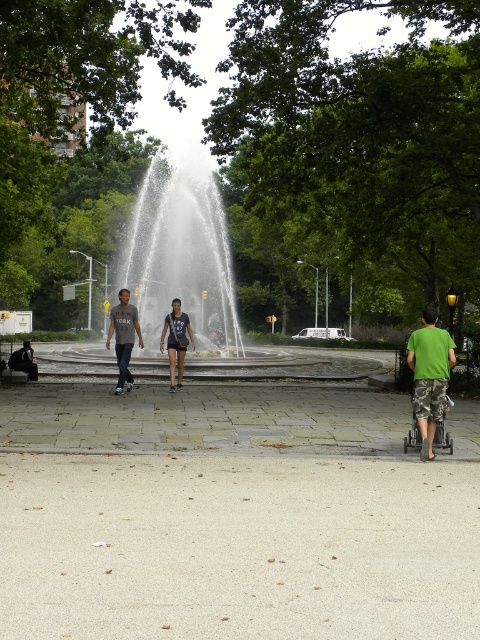
Can you confirm if matte gray t-shirt at center is smaller than matte black shorts at center?

Actually, matte gray t-shirt at center might be larger than matte black shorts at center.

Can you confirm if matte gray t-shirt at center is positioned to the right of matte black shorts at center?

In fact, matte gray t-shirt at center is to the left of matte black shorts at center.

Does point (129, 292) lie in front of point (175, 305)?

That is True.

The width and height of the screenshot is (480, 640). What are the coordinates of `matte gray t-shirt at center` in the screenshot? It's located at (123, 337).

Is the position of matte gray t-shirt at center more distant than that of gray cotton t-shirt at left?

No, it is not.

Is matte gray t-shirt at center to the right of gray cotton t-shirt at left from the viewer's perspective?

Correct, you'll find matte gray t-shirt at center to the right of gray cotton t-shirt at left.

Find the location of a particular element. matte gray t-shirt at center is located at coordinates (123, 337).

Measure the distance between point (452, 356) and camera.

A distance of 9.55 meters exists between point (452, 356) and camera.

Is green camouflage pants at right to the right of matte gray t-shirt at center from the viewer's perspective?

Correct, you'll find green camouflage pants at right to the right of matte gray t-shirt at center.

Is point (423, 426) behind point (176, 339)?

No, (423, 426) is in front of (176, 339).

You are a GUI agent. You are given a task and a screenshot of the screen. Output one action in this format:
    pyautogui.click(x=<x>, y=<y>)
    Task: Click on the green camouflage pants at right
    The height and width of the screenshot is (640, 480).
    Given the screenshot: What is the action you would take?
    pyautogui.click(x=430, y=376)